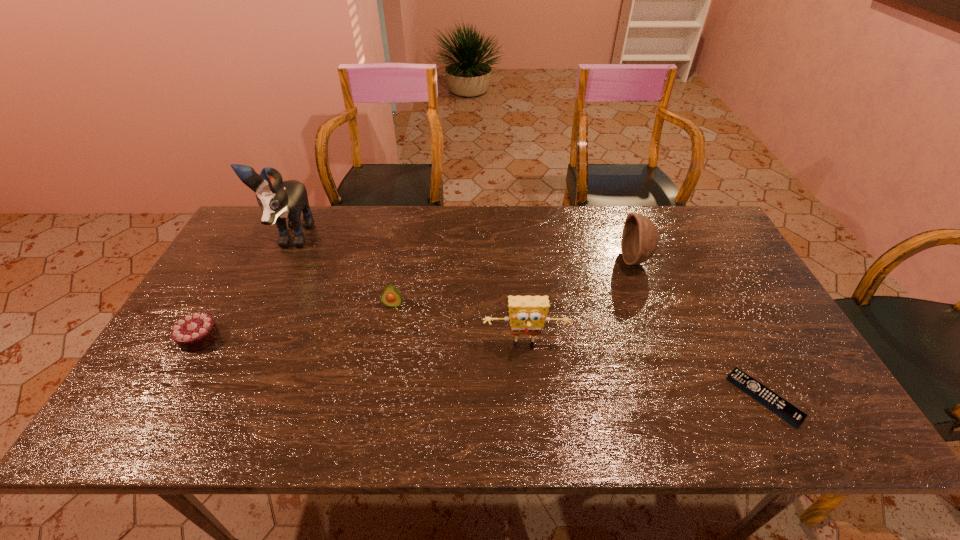
At what (x,y) coordinates should I click in order to perform the action: click on puppy. Please return your answer as a coordinate pair (x, y). Looking at the image, I should click on (278, 199).

Image resolution: width=960 pixels, height=540 pixels. What are the coordinates of `the second object from left to right` in the screenshot? It's located at (278, 199).

At what (x,y) coordinates should I click in order to perform the action: click on bowl. Please return your answer as a coordinate pair (x, y). The image size is (960, 540). Looking at the image, I should click on (640, 238).

Image resolution: width=960 pixels, height=540 pixels. Identify the location of the fourth object from left to right. (527, 314).

Where is `the third shortest object`? the third shortest object is located at coordinates (391, 297).

Find the location of a particular element. This screenshot has width=960, height=540. the fourth nearest object is located at coordinates (391, 297).

Locate an element on the screen. the fifth tallest object is located at coordinates (194, 332).

Where is `the leftmost object`? The height and width of the screenshot is (540, 960). the leftmost object is located at coordinates (194, 332).

The image size is (960, 540). I want to click on the nearest object, so click(x=781, y=407).

This screenshot has height=540, width=960. In order to click on the rightmost object in this screenshot , I will do `click(781, 407)`.